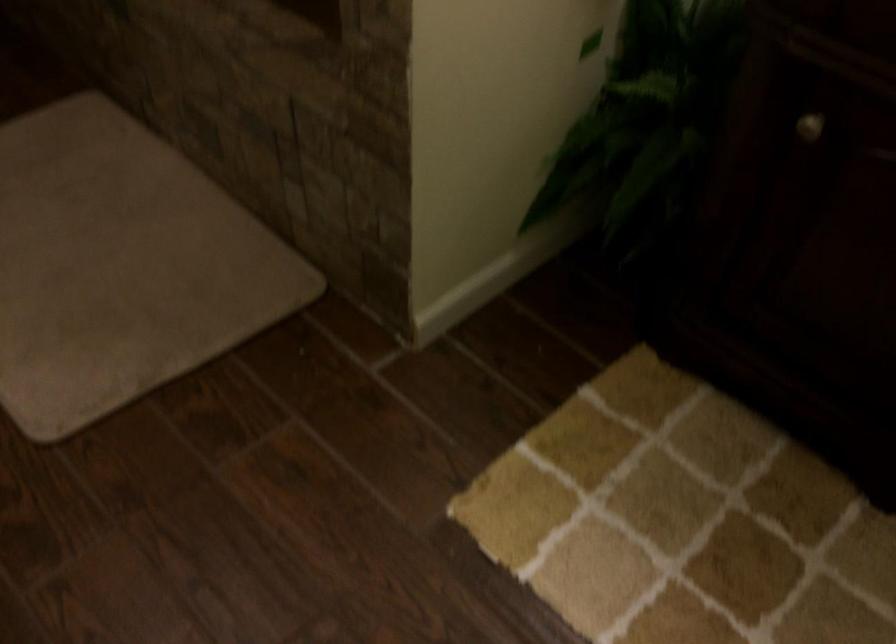
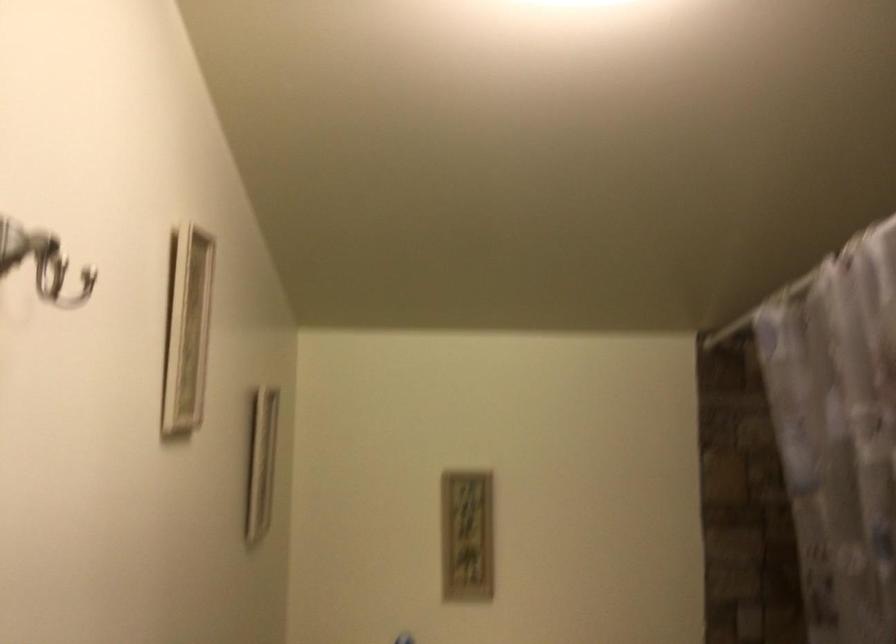
The images are taken continuously from a first-person perspective. In which direction is your viewpoint rotating?

The rotation direction of the camera is left-up.